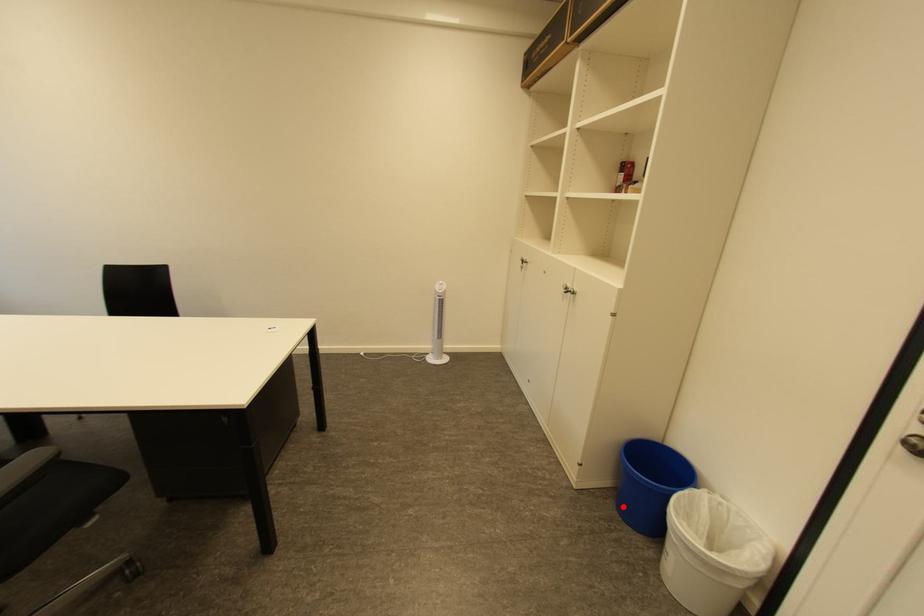
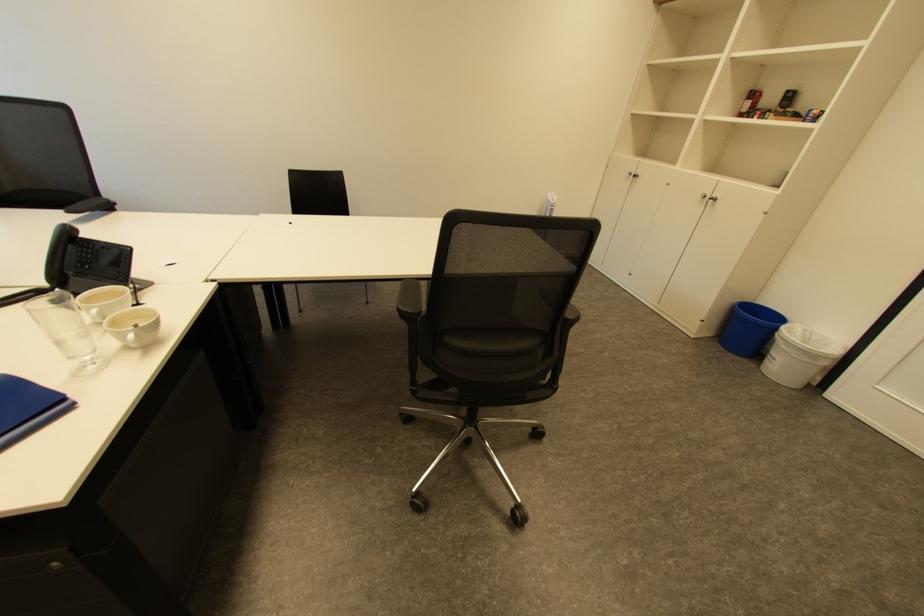
In the second image, find the point that corresponds to the highlighted location in the first image.

(728, 346)